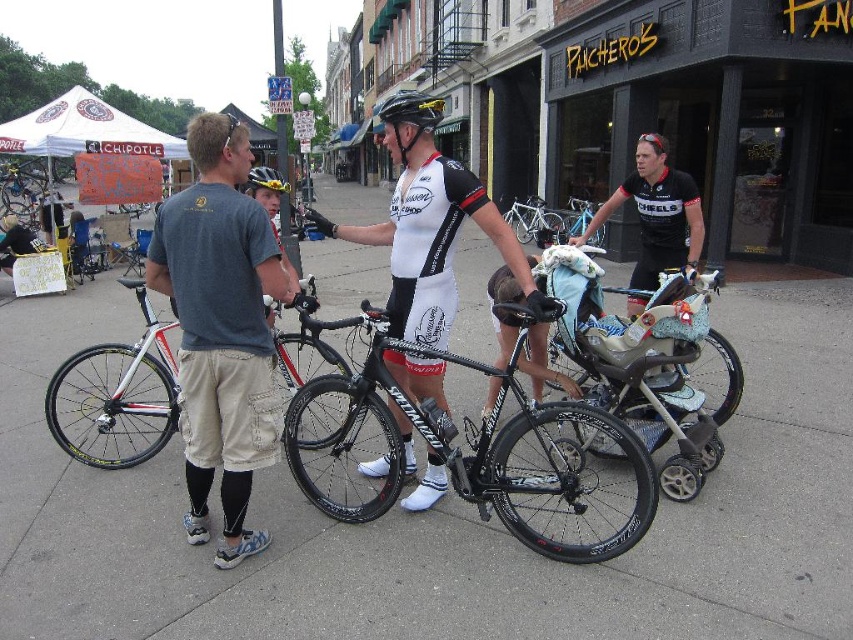
Question: Is gray cotton t-shirt at center to the right of silver metallic bicycle at center from the viewer's perspective?

Choices:
 (A) yes
 (B) no

Answer: (B)

Question: Which point is farther from the camera taking this photo?

Choices:
 (A) (189, 524)
 (B) (132, 280)
 (C) (409, 244)

Answer: (B)

Question: Which of the following is the farthest from the observer?

Choices:
 (A) gray concrete pavement at center
 (B) shiny black frame at center
 (C) white matte bicycle at left
 (D) white matte cycling jersey at center

Answer: (C)

Question: Does gray cotton t-shirt at center have a greater width compared to silver metallic bicycle at center?

Choices:
 (A) no
 (B) yes

Answer: (B)

Question: Observing the image, what is the correct spatial positioning of gray cotton t-shirt at center in reference to white matte bicycle at left?

Choices:
 (A) below
 (B) above

Answer: (B)

Question: Which is nearer to the light blue fabric stroller at center?

Choices:
 (A) white matte bicycle at left
 (B) shiny black helmet at center
 (C) white matte cycling jersey at center
 (D) matte black helmet at center

Answer: (C)